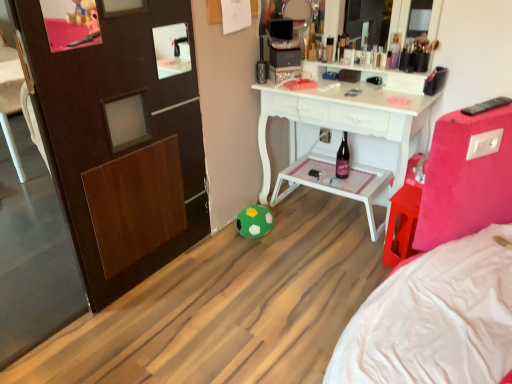
Question: In which direction should I rotate to look at metallic silver toiletry at center, acting as the second toiletry starting from the right?

Choices:
 (A) left
 (B) right

Answer: (B)

Question: Considering the relative sizes of metallic silver toiletries at upper center, which appears as the 2th toiletry when viewed from the left, and metallic silver toiletry at center, acting as the second toiletry starting from the right, in the image provided, is metallic silver toiletries at upper center, which appears as the 2th toiletry when viewed from the left, wider than metallic silver toiletry at center, acting as the second toiletry starting from the right,?

Choices:
 (A) yes
 (B) no

Answer: (A)

Question: Does metallic silver toiletries at upper center, which appears as the 2th toiletry when viewed from the left, have a smaller size compared to metallic silver toiletry at center, the first toiletry from the left?

Choices:
 (A) yes
 (B) no

Answer: (B)

Question: Is metallic silver toiletries at upper center, placed as the 1th toiletry when sorted from right to left, in front of metallic silver toiletry at center, the first toiletry from the left?

Choices:
 (A) yes
 (B) no

Answer: (A)

Question: Does metallic silver toiletries at upper center, which appears as the 2th toiletry when viewed from the left, have a greater height compared to metallic silver toiletry at center, acting as the second toiletry starting from the right?

Choices:
 (A) no
 (B) yes

Answer: (B)

Question: Does metallic silver toiletries at upper center, placed as the 1th toiletry when sorted from right to left, have a lesser height compared to metallic silver toiletry at center, acting as the second toiletry starting from the right?

Choices:
 (A) yes
 (B) no

Answer: (B)

Question: From a real-world perspective, is metallic silver toiletries at upper center, placed as the 1th toiletry when sorted from right to left, positioned under metallic silver toiletry at center, acting as the second toiletry starting from the right, based on gravity?

Choices:
 (A) no
 (B) yes

Answer: (A)

Question: Is green felt ball at lower center far away from black plastic remote control at upper right?

Choices:
 (A) yes
 (B) no

Answer: (A)

Question: Considering the relative sizes of green felt ball at lower center and black plastic remote control at upper right in the image provided, is green felt ball at lower center wider than black plastic remote control at upper right?

Choices:
 (A) no
 (B) yes

Answer: (A)

Question: Does green felt ball at lower center have a lesser width compared to black plastic remote control at upper right?

Choices:
 (A) yes
 (B) no

Answer: (A)

Question: Would you say black plastic remote control at upper right is part of green felt ball at lower center's contents?

Choices:
 (A) yes
 (B) no

Answer: (B)

Question: Can you confirm if green felt ball at lower center is smaller than black plastic remote control at upper right?

Choices:
 (A) yes
 (B) no

Answer: (B)

Question: Does green felt ball at lower center appear on the left side of black plastic remote control at upper right?

Choices:
 (A) yes
 (B) no

Answer: (A)

Question: Considering the relative sizes of metallic silver toiletry at center, the first toiletry from the left, and metallic silver toiletries at upper center, placed as the 1th toiletry when sorted from right to left, in the image provided, is metallic silver toiletry at center, the first toiletry from the left, taller than metallic silver toiletries at upper center, placed as the 1th toiletry when sorted from right to left,?

Choices:
 (A) yes
 (B) no

Answer: (B)